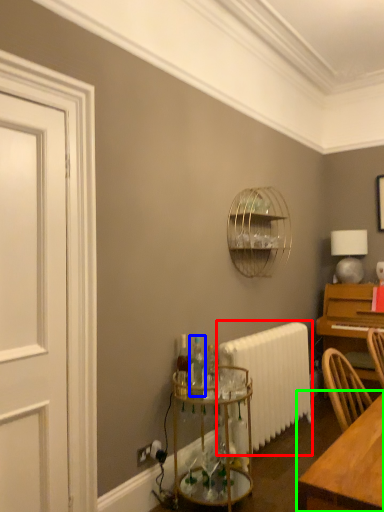
Question: Which object is positioned farthest from radiator (highlighted by a red box)? Select from bottle (highlighted by a blue box) and table (highlighted by a green box).

Choices:
 (A) bottle
 (B) table

Answer: (B)